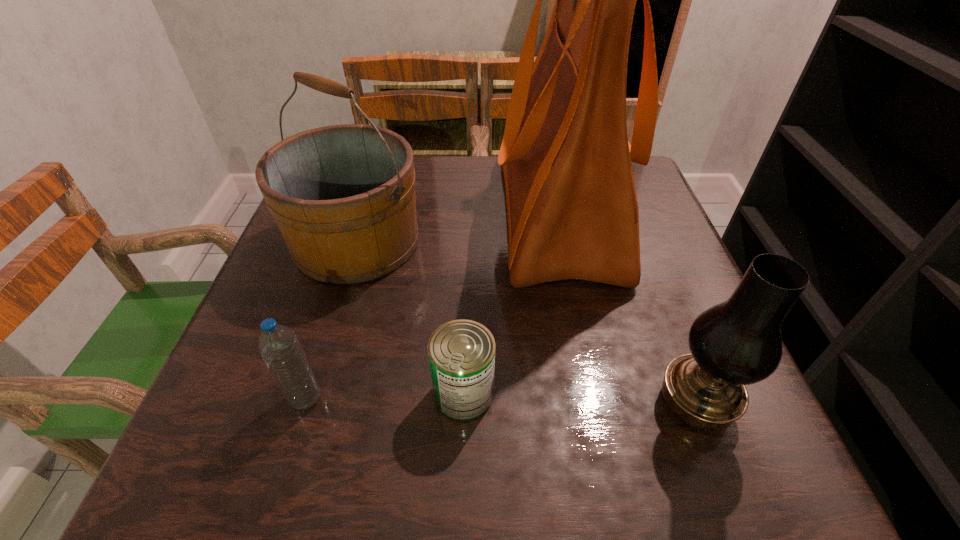
Find the location of a particular element. object that is the fourth closest to the fourth tallest object is located at coordinates (738, 342).

Find the location of a particular element. This screenshot has width=960, height=540. the fourth closest object to the can is located at coordinates 738,342.

Where is `free space that satisfies the following two spatial constraints: 1. on the front pocket of the shopping bag; 2. on the right side of the oil lamp`? free space that satisfies the following two spatial constraints: 1. on the front pocket of the shopping bag; 2. on the right side of the oil lamp is located at coordinates (597, 403).

Locate an element on the screen. This screenshot has height=540, width=960. free location that satisfies the following two spatial constraints: 1. on the front pocket of the tallest object; 2. on the right side of the oil lamp is located at coordinates (597, 403).